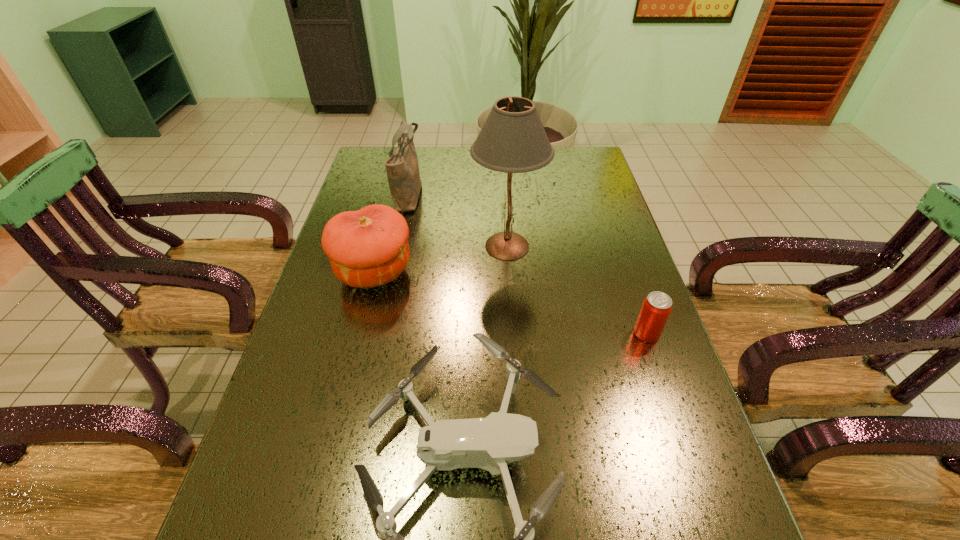
Where is `table lamp`? table lamp is located at coordinates (513, 140).

In order to click on shoulder bag in this screenshot , I will do `click(402, 168)`.

Image resolution: width=960 pixels, height=540 pixels. In order to click on the second tallest object in this screenshot , I will do `click(402, 168)`.

At what (x,y) coordinates should I click in order to perform the action: click on pumpkin. Please return your answer as a coordinate pair (x, y). Looking at the image, I should click on (367, 248).

In order to click on the fourth farthest object in this screenshot , I will do `click(657, 306)`.

The width and height of the screenshot is (960, 540). I want to click on can, so [657, 306].

The height and width of the screenshot is (540, 960). Find the location of `vacant space located 0.160m on the front-facing side of the tallest object`. vacant space located 0.160m on the front-facing side of the tallest object is located at coordinates (417, 246).

Image resolution: width=960 pixels, height=540 pixels. In order to click on blank space located 0.230m on the front-facing side of the tallest object in this screenshot , I will do `click(392, 246)`.

I want to click on free location located on the front-facing side of the tallest object, so click(x=365, y=246).

At what (x,y) coordinates should I click in order to perform the action: click on free space located 0.400m on the front-facing side of the second tallest object. Please return your answer as a coordinate pair (x, y). This screenshot has width=960, height=540. Looking at the image, I should click on (543, 194).